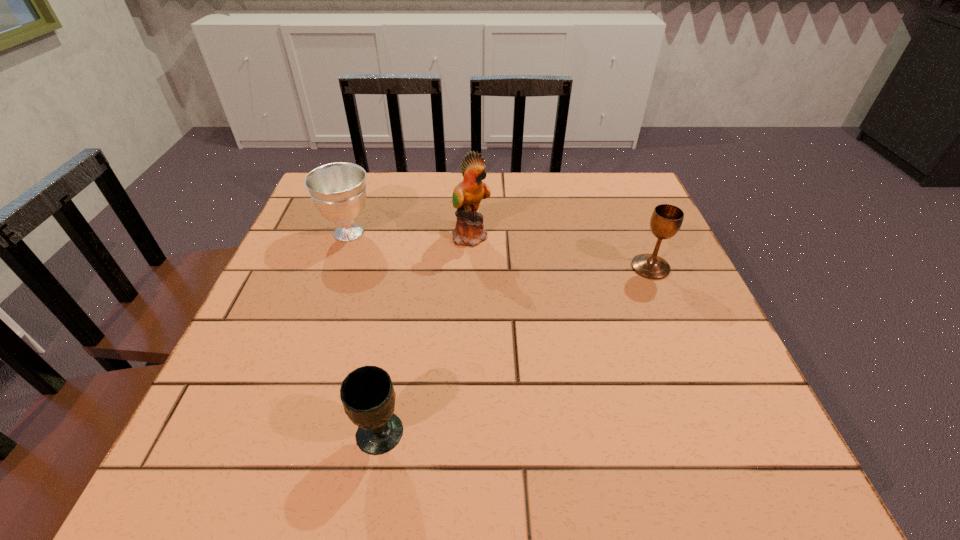
Locate an element on the screen. free location that satisfies the following two spatial constraints: 1. on the back side of the third farthest object; 2. on the left side of the nearest object is located at coordinates (409, 267).